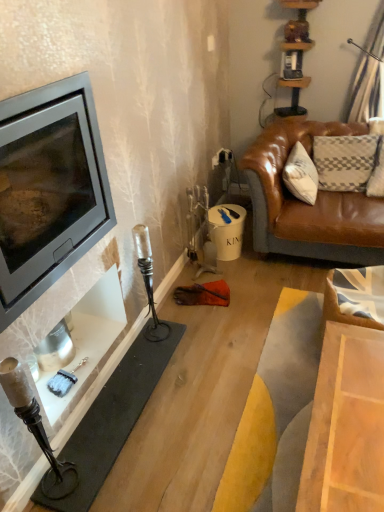
The height and width of the screenshot is (512, 384). Find the location of `free space above matte black fireplace at left (from a real-world perspective)`. free space above matte black fireplace at left (from a real-world perspective) is located at coordinates point(112,351).